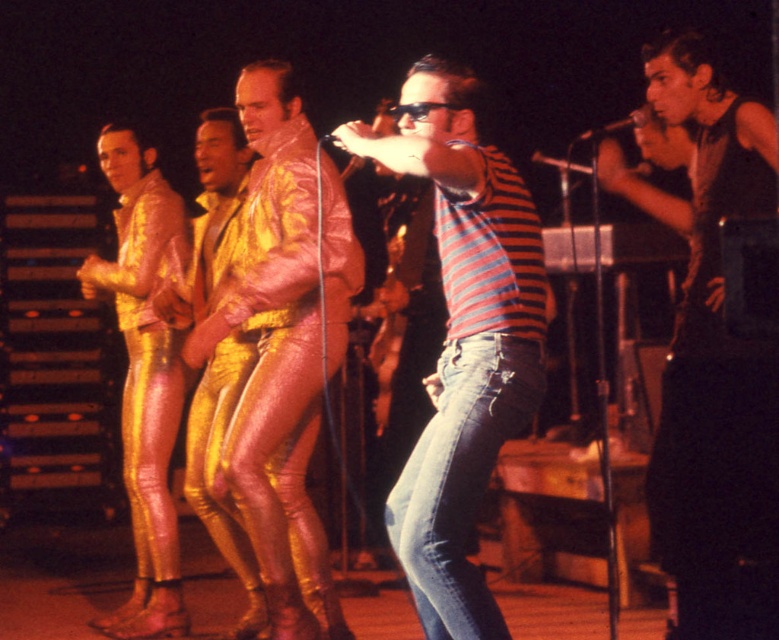
You are a costume designer preparing for a performance. You have two costume options to choose from for the lead performer. The first option is the blue denim jeans at center, and the second is the gold shiny pants at left. Based on the image, which costume would allow for more comfortable movement during a dance routine that requires wide leg movements?

The blue denim jeans at center would allow for more comfortable movement during the dance routine because they are wider than the gold shiny pants at left.

You are a stagehand preparing to adjust the lighting for the performance. You need to ensure that the blue denim jeans at center and the metallic silver microphone at upper center are both well lit. Given their sizes, which object requires a wider spotlight to cover it adequately?

The blue denim jeans at center requires a wider spotlight because its width is larger than the metallic silver microphone at upper center.